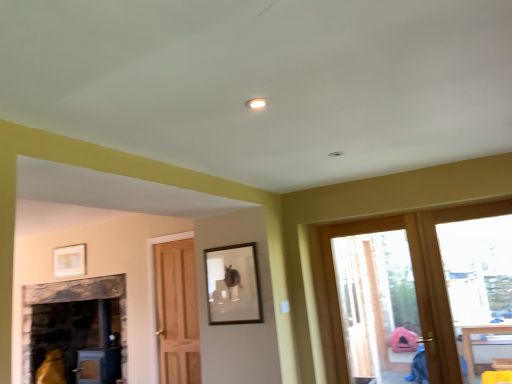
Question: Would you consider matte white picture frame at upper left, placed as the first picture frame when sorted from back to front, to be distant from matte black picture frame at center, which appears as the 1th picture frame when viewed from the front?

Choices:
 (A) yes
 (B) no

Answer: (A)

Question: From a real-world perspective, is matte white picture frame at upper left, which is counted as the 1th picture frame, starting from the left, located higher than matte black picture frame at center, which ranks as the 2th picture frame in left-to-right order?

Choices:
 (A) yes
 (B) no

Answer: (A)

Question: Is matte white picture frame at upper left, placed as the first picture frame when sorted from back to front, turned away from matte black picture frame at center, the first picture frame viewed from the right?

Choices:
 (A) no
 (B) yes

Answer: (A)

Question: Are matte white picture frame at upper left, marked as the 2th picture frame in a front-to-back arrangement, and matte black picture frame at center, the first picture frame viewed from the right, beside each other?

Choices:
 (A) yes
 (B) no

Answer: (B)

Question: Is matte white picture frame at upper left, which is counted as the 1th picture frame, starting from the left, wider than matte black picture frame at center, which appears as the 1th picture frame when viewed from the front?

Choices:
 (A) no
 (B) yes

Answer: (A)

Question: From a real-world perspective, is matte white picture frame at upper left, placed as the first picture frame when sorted from back to front, positioned under matte black picture frame at center, the second picture frame from the back, based on gravity?

Choices:
 (A) yes
 (B) no

Answer: (B)

Question: Considering the relative sizes of clear glass door at right, which is the 2th window in left-to-right order, and matte black picture frame at center, the first picture frame viewed from the right, in the image provided, is clear glass door at right, which is the 2th window in left-to-right order, wider than matte black picture frame at center, the first picture frame viewed from the right,?

Choices:
 (A) yes
 (B) no

Answer: (A)

Question: From a real-world perspective, is clear glass door at right, which is the 2th window in left-to-right order, on top of matte black picture frame at center, which appears as the 1th picture frame when viewed from the front?

Choices:
 (A) no
 (B) yes

Answer: (A)

Question: Is clear glass door at right, which is the 2th window in left-to-right order, shorter than matte black picture frame at center, the second picture frame from the back?

Choices:
 (A) no
 (B) yes

Answer: (A)

Question: Is there a large distance between clear glass door at right, positioned as the 1th window in right-to-left order, and matte black picture frame at center, the second picture frame from the back?

Choices:
 (A) no
 (B) yes

Answer: (B)

Question: Is clear glass door at right, positioned as the 1th window in right-to-left order, positioned before matte black picture frame at center, which appears as the 1th picture frame when viewed from the front?

Choices:
 (A) yes
 (B) no

Answer: (A)

Question: Is clear glass door at right, which is the 2th window in left-to-right order, further to the viewer compared to matte black picture frame at center, the first picture frame viewed from the right?

Choices:
 (A) yes
 (B) no

Answer: (B)

Question: Is transparent glass door at right, acting as the second window starting from the right, further to the viewer compared to matte white picture frame at upper left, marked as the 2th picture frame in a front-to-back arrangement?

Choices:
 (A) yes
 (B) no

Answer: (B)